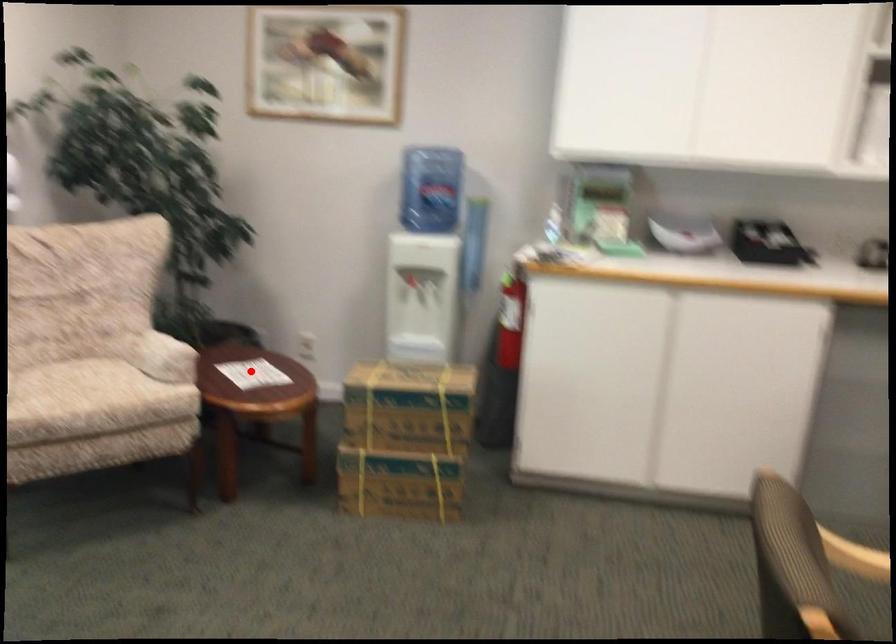
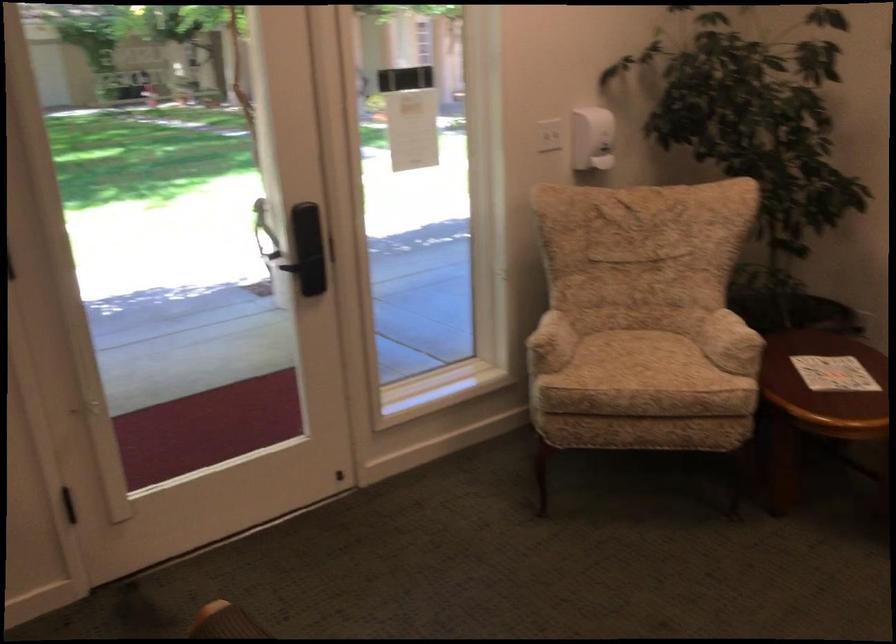
Locate, in the second image, the point that corresponds to the highlighted location in the first image.

(833, 373)